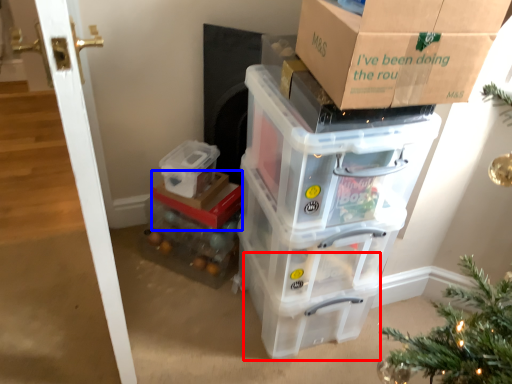
Question: Which object appears closest to the camera in this image, storage box (highlighted by a red box) or storage box (highlighted by a blue box)?

Choices:
 (A) storage box
 (B) storage box

Answer: (A)